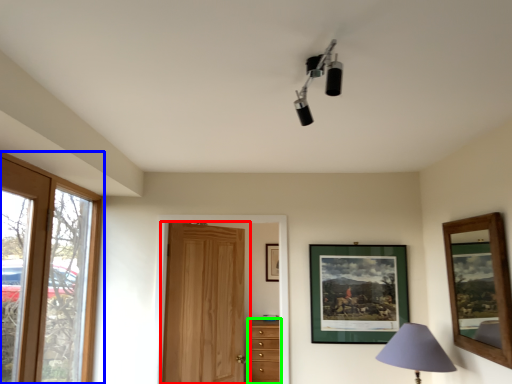
Question: Considering the real-world distances, which object is closest to door (highlighted by a red box)? window (highlighted by a blue box) or chest of drawers (highlighted by a green box).

Choices:
 (A) window
 (B) chest of drawers

Answer: (B)